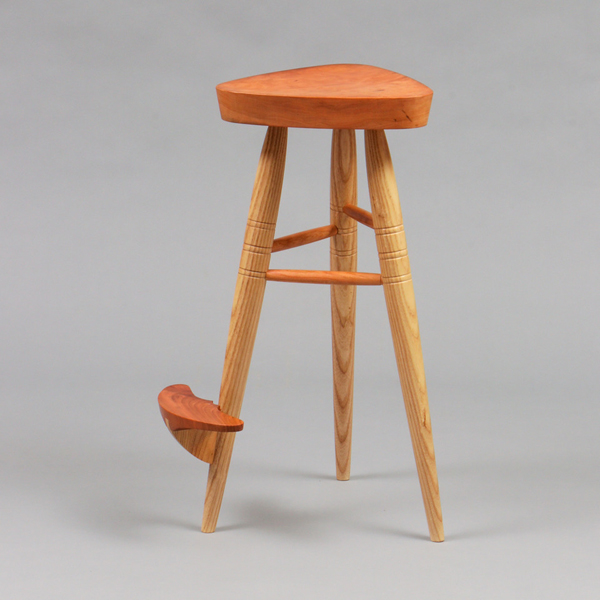
Where is `main foot rest`? Image resolution: width=600 pixels, height=600 pixels. main foot rest is located at coordinates click(179, 410).